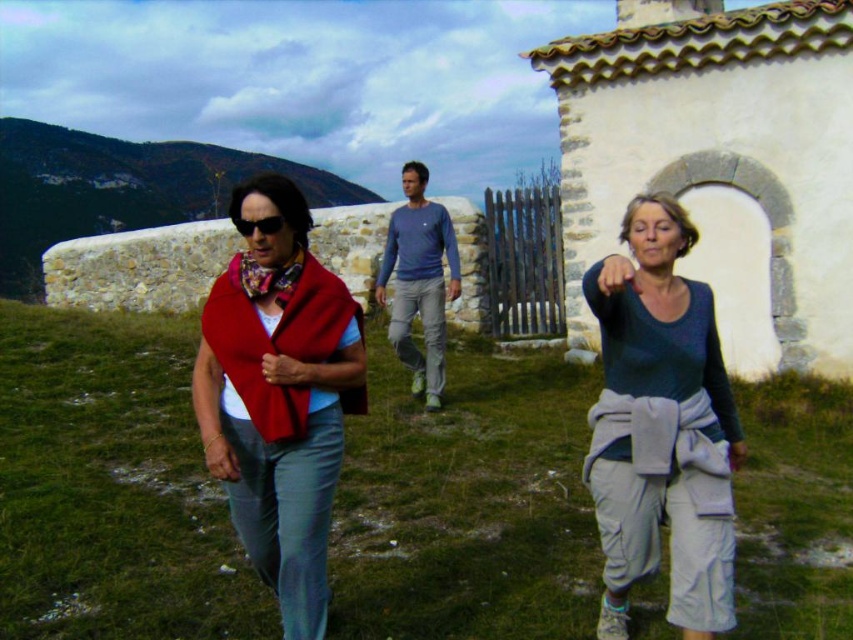
Question: Among these points, which one is farthest from the camera?

Choices:
 (A) (432, 262)
 (B) (276, 336)
 (C) (236, 276)
 (D) (236, 227)

Answer: (A)

Question: Is blue cotton shirt at center positioned behind floral silk scarf at center?

Choices:
 (A) no
 (B) yes

Answer: (B)

Question: Which object appears farthest from the camera in this image?

Choices:
 (A) blue cotton shirt at center
 (B) floral silk scarf at center
 (C) black reflective sunglasses at center
 (D) teal matte shirt at center

Answer: (A)

Question: Does matte red shawl at center come behind blue cotton shirt at center?

Choices:
 (A) yes
 (B) no

Answer: (B)

Question: Which of the following is the farthest from the observer?

Choices:
 (A) blue cotton shirt at center
 (B) floral silk scarf at center
 (C) black reflective sunglasses at center
 (D) teal matte shirt at center

Answer: (A)

Question: Can you confirm if blue cotton shirt at center is positioned to the right of black reflective sunglasses at center?

Choices:
 (A) no
 (B) yes

Answer: (B)